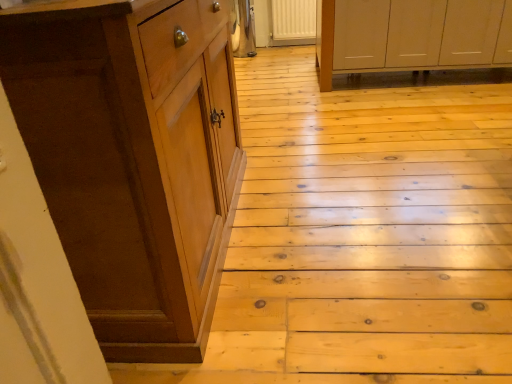
Question: Considering the relative sizes of brown wood cabinet at left, which is the first cabinetry from front to back, and white matte cabinet at upper right, the 2th cabinetry in the bottom-to-top sequence, in the image provided, is brown wood cabinet at left, which is the first cabinetry from front to back, thinner than white matte cabinet at upper right, the 2th cabinetry in the bottom-to-top sequence,?

Choices:
 (A) no
 (B) yes

Answer: (B)

Question: Is brown wood cabinet at left, the 2th cabinetry from the right, shorter than white matte cabinet at upper right, arranged as the 1th cabinetry when viewed from the top?

Choices:
 (A) no
 (B) yes

Answer: (A)

Question: Considering the relative sizes of brown wood cabinet at left, which is the 2th cabinetry in back-to-front order, and white matte cabinet at upper right, the 1th cabinetry in the back-to-front sequence, in the image provided, is brown wood cabinet at left, which is the 2th cabinetry in back-to-front order, smaller than white matte cabinet at upper right, the 1th cabinetry in the back-to-front sequence,?

Choices:
 (A) yes
 (B) no

Answer: (A)

Question: Is brown wood cabinet at left, which is the 2th cabinetry in top-to-bottom order, touching white matte cabinet at upper right, the 2th cabinetry in the bottom-to-top sequence?

Choices:
 (A) no
 (B) yes

Answer: (A)

Question: Is brown wood cabinet at left, which is the first cabinetry from front to back, not inside white matte cabinet at upper right, the first cabinetry from the right?

Choices:
 (A) no
 (B) yes

Answer: (B)

Question: From the image's perspective, would you say brown wood cabinet at left, which is the 2th cabinetry in back-to-front order, is positioned over white matte cabinet at upper right, the 2th cabinetry in the bottom-to-top sequence?

Choices:
 (A) yes
 (B) no

Answer: (B)

Question: Considering the relative positions of white matte cabinet at upper right, positioned as the 2th cabinetry in left-to-right order, and wooden at left in the image provided, is white matte cabinet at upper right, positioned as the 2th cabinetry in left-to-right order, behind wooden at left?

Choices:
 (A) yes
 (B) no

Answer: (A)

Question: Could you tell me if white matte cabinet at upper right, the first cabinetry from the right, is facing wooden at left?

Choices:
 (A) no
 (B) yes

Answer: (B)

Question: Considering the relative positions of white matte cabinet at upper right, the 2th cabinetry in the bottom-to-top sequence, and wooden at left in the image provided, is white matte cabinet at upper right, the 2th cabinetry in the bottom-to-top sequence, in front of wooden at left?

Choices:
 (A) yes
 (B) no

Answer: (B)

Question: Is white matte cabinet at upper right, positioned as the 2th cabinetry in left-to-right order, looking in the opposite direction of wooden at left?

Choices:
 (A) yes
 (B) no

Answer: (B)

Question: Does white matte cabinet at upper right, positioned as the 2th cabinetry in left-to-right order, appear on the left side of wooden at left?

Choices:
 (A) yes
 (B) no

Answer: (B)

Question: From a real-world perspective, is white matte cabinet at upper right, the first cabinetry from the right, on top of wooden at left?

Choices:
 (A) no
 (B) yes

Answer: (B)

Question: Does brown wood cabinet at left, which is the 2th cabinetry in top-to-bottom order, have a smaller size compared to wooden at left?

Choices:
 (A) no
 (B) yes

Answer: (B)